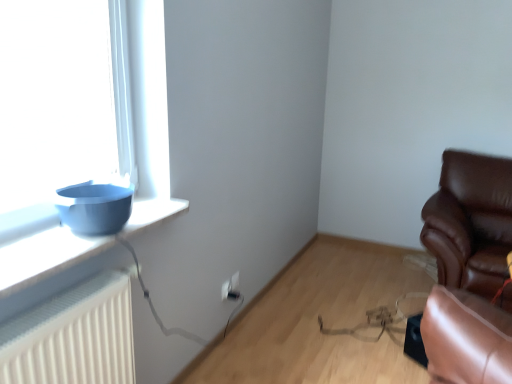
Locate an element on the screen. The width and height of the screenshot is (512, 384). white plastic electric outlet at lower center is located at coordinates (231, 288).

Image resolution: width=512 pixels, height=384 pixels. I want to click on chair on the right side of white plastic electric outlet at lower center, so click(469, 270).

Is point (230, 288) farther from camera compared to point (500, 164)?

No, it is not.

Can you confirm if white plastic electric outlet at lower center is thinner than brown leather chair at right?

Yes, white plastic electric outlet at lower center is thinner than brown leather chair at right.

How far apart are brown leather chair at right and white plastic electric outlet at lower center?

The distance of brown leather chair at right from white plastic electric outlet at lower center is 1.45 meters.

Does point (504, 262) come closer to viewer compared to point (225, 296)?

No, it is behind (225, 296).

Are brown leather chair at right and white plastic electric outlet at lower center located far from each other?

Yes, brown leather chair at right and white plastic electric outlet at lower center are located far from each other.

Can white plastic electric outlet at lower center be found inside brown leather chair at right?

No, white plastic electric outlet at lower center is not a part of brown leather chair at right.

Which object is positioned more to the right, brown leather chair at right or matte blue bowl at left?

brown leather chair at right.

Based on the photo, is brown leather chair at right beside matte blue bowl at left?

No, brown leather chair at right is not in contact with matte blue bowl at left.

From the image's perspective, is brown leather chair at right located above or below matte blue bowl at left?

brown leather chair at right is situated lower than matte blue bowl at left in the image.

Identify the location of chair that is below the matte blue bowl at left (from the image's perspective). (469, 270).

Are matte blue bowl at left and brown leather chair at right beside each other?

matte blue bowl at left is not next to brown leather chair at right, and they're not touching.

Is matte blue bowl at left shorter than brown leather chair at right?

Correct, matte blue bowl at left is not as tall as brown leather chair at right.

Which of these two, matte blue bowl at left or brown leather chair at right, is wider?

With larger width is brown leather chair at right.

Is matte blue bowl at left inside the boundaries of brown leather chair at right, or outside?

matte blue bowl at left is located beyond the bounds of brown leather chair at right.

Is matte blue bowl at left wider than white plastic electric outlet at lower center?

Yes.

Identify the location of electric outlet behind the matte blue bowl at left. The image size is (512, 384). (231, 288).

Is matte blue bowl at left facing towards white plastic electric outlet at lower center?

No, matte blue bowl at left is not aimed at white plastic electric outlet at lower center.

Does matte blue bowl at left have a smaller size compared to white plastic electric outlet at lower center?

No.

Is white plastic electric outlet at lower center looking in the opposite direction of matte blue bowl at left?

No, white plastic electric outlet at lower center is not facing away from matte blue bowl at left.

Who is smaller, white plastic electric outlet at lower center or matte blue bowl at left?

Smaller between the two is white plastic electric outlet at lower center.

How many degrees apart are the facing directions of white plastic electric outlet at lower center and matte blue bowl at left?

white plastic electric outlet at lower center and matte blue bowl at left are facing 3.92 degrees away from each other.

Is white plastic electric outlet at lower center to the left of matte blue bowl at left from the viewer's perspective?

No.

Identify the location of electric outlet on the left of brown leather chair at right. Image resolution: width=512 pixels, height=384 pixels. 231,288.

The image size is (512, 384). Identify the location of chair in front of the white plastic electric outlet at lower center. (469, 270).

Which object lies nearer to the anchor point matte blue bowl at left, white plastic electric outlet at lower center or brown leather chair at right?

Among the two, white plastic electric outlet at lower center is located nearer to matte blue bowl at left.

In the scene shown: When comparing their distances from brown leather chair at right, does matte blue bowl at left or white plastic electric outlet at lower center seem further?

matte blue bowl at left is positioned further to the anchor brown leather chair at right.

Estimate the real-world distances between objects in this image. Which object is closer to matte blue bowl at left, brown leather chair at right or white plastic electric outlet at lower center?

The object closer to matte blue bowl at left is white plastic electric outlet at lower center.

Which object lies further to the anchor point white plastic electric outlet at lower center, matte blue bowl at left or brown leather chair at right?

brown leather chair at right is positioned further to the anchor white plastic electric outlet at lower center.

From the image, which object appears to be farther from white plastic electric outlet at lower center, brown leather chair at right or matte blue bowl at left?

brown leather chair at right is positioned further to the anchor white plastic electric outlet at lower center.

Looking at the image, which one is located further to brown leather chair at right, white plastic electric outlet at lower center or matte blue bowl at left?

matte blue bowl at left is positioned further to the anchor brown leather chair at right.

You are a GUI agent. You are given a task and a screenshot of the screen. Output one action in this format:
    pyautogui.click(x=<x>, y=<y>)
    Task: Click on the electric outlet between matte blue bowl at left and brown leather chair at right from left to right
    The width and height of the screenshot is (512, 384).
    Given the screenshot: What is the action you would take?
    pyautogui.click(x=231, y=288)